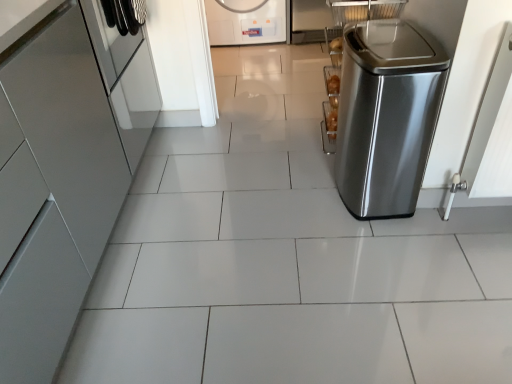
Image resolution: width=512 pixels, height=384 pixels. I want to click on white glossy washing machine at upper center, the second home appliance when ordered from left to right, so click(246, 22).

Is the surface of white glossy washing machine at upper center, the second home appliance when ordered from left to right, in direct contact with glossy metallic cabinet at left, positioned as the first home appliance in left-to-right order?

No, white glossy washing machine at upper center, the second home appliance when ordered from left to right, is not in contact with glossy metallic cabinet at left, positioned as the first home appliance in left-to-right order.

Who is smaller, white glossy washing machine at upper center, positioned as the 1th home appliance in back-to-front order, or glossy metallic cabinet at left, marked as the 3th home appliance in a right-to-left arrangement?

white glossy washing machine at upper center, positioned as the 1th home appliance in back-to-front order, is smaller.

Can you confirm if white glossy washing machine at upper center, positioned as the 1th home appliance in back-to-front order, is wider than glossy metallic cabinet at left, positioned as the first home appliance in left-to-right order?

Yes.

From the image's perspective, between white glossy washing machine at upper center, positioned as the 1th home appliance in back-to-front order, and glossy metallic cabinet at left, which is counted as the 2th home appliance, starting from the back, which one is located above?

white glossy washing machine at upper center, positioned as the 1th home appliance in back-to-front order.

Does point (34, 59) come in front of point (433, 64)?

Yes, point (34, 59) is in front of point (433, 64).

From a real-world perspective, is glossy metallic cabinet at left, the 2th home appliance when ordered from front to back, physically located above or below stainless steel trash can at right, the first home appliance positioned from the front?

Clearly, from a real-world perspective, glossy metallic cabinet at left, the 2th home appliance when ordered from front to back, is above stainless steel trash can at right, the first home appliance positioned from the front.

Which object is thinner, glossy metallic cabinet at left, marked as the 3th home appliance in a right-to-left arrangement, or stainless steel trash can at right, which appears as the first home appliance when viewed from the right?

Thinner between the two is stainless steel trash can at right, which appears as the first home appliance when viewed from the right.

Would you say glossy metallic cabinet at left, positioned as the first home appliance in left-to-right order, is a long distance from stainless steel trash can at right, arranged as the 3th home appliance when viewed from the left?

Yes, glossy metallic cabinet at left, positioned as the first home appliance in left-to-right order, and stainless steel trash can at right, arranged as the 3th home appliance when viewed from the left, are quite far apart.

Which is correct: stainless steel trash can at right, which appears as the first home appliance when viewed from the right, is inside glossy metallic cabinet at left, marked as the 3th home appliance in a right-to-left arrangement, or outside of it?

stainless steel trash can at right, which appears as the first home appliance when viewed from the right, is outside glossy metallic cabinet at left, marked as the 3th home appliance in a right-to-left arrangement.

Which is farther, [383,107] or [95,78]?

Positioned behind is point [383,107].

Is stainless steel trash can at right, arranged as the 3th home appliance when viewed from the left, next to glossy metallic cabinet at left, the 2th home appliance when ordered from front to back, and touching it?

stainless steel trash can at right, arranged as the 3th home appliance when viewed from the left, is not next to glossy metallic cabinet at left, the 2th home appliance when ordered from front to back, and they're not touching.

Is stainless steel trash can at right, which ranks as the third home appliance in back-to-front order, inside or outside of white glossy washing machine at upper center, arranged as the second home appliance when viewed from the right?

stainless steel trash can at right, which ranks as the third home appliance in back-to-front order, lies outside white glossy washing machine at upper center, arranged as the second home appliance when viewed from the right.

Could you tell me if stainless steel trash can at right, arranged as the 3th home appliance when viewed from the left, is turned towards white glossy washing machine at upper center, the second home appliance when ordered from left to right?

No, stainless steel trash can at right, arranged as the 3th home appliance when viewed from the left, does not turn towards white glossy washing machine at upper center, the second home appliance when ordered from left to right.

Which object is thinner, stainless steel trash can at right, which appears as the first home appliance when viewed from the right, or white glossy washing machine at upper center, positioned as the 1th home appliance in back-to-front order?

stainless steel trash can at right, which appears as the first home appliance when viewed from the right, is thinner.

Looking at this image, what's the angular difference between white glossy washing machine at upper center, the 3th home appliance viewed from the front, and stainless steel trash can at right, which appears as the first home appliance when viewed from the right,'s facing directions?

white glossy washing machine at upper center, the 3th home appliance viewed from the front, and stainless steel trash can at right, which appears as the first home appliance when viewed from the right, are facing 88.5 degrees away from each other.

In the scene shown: Which object is positioned more to the left, white glossy washing machine at upper center, positioned as the 1th home appliance in back-to-front order, or stainless steel trash can at right, arranged as the 3th home appliance when viewed from the left?

Positioned to the left is white glossy washing machine at upper center, positioned as the 1th home appliance in back-to-front order.

From a real-world perspective, is white glossy washing machine at upper center, the 3th home appliance viewed from the front, beneath stainless steel trash can at right, which ranks as the third home appliance in back-to-front order?

Yes, from a real-world perspective, white glossy washing machine at upper center, the 3th home appliance viewed from the front, is beneath stainless steel trash can at right, which ranks as the third home appliance in back-to-front order.

From the image's perspective, is white glossy washing machine at upper center, the second home appliance when ordered from left to right, on stainless steel trash can at right, which ranks as the third home appliance in back-to-front order?

Yes, from the image's perspective, white glossy washing machine at upper center, the second home appliance when ordered from left to right, is above stainless steel trash can at right, which ranks as the third home appliance in back-to-front order.

Is glossy metallic cabinet at left, which is counted as the 2th home appliance, starting from the back, facing towards white glossy washing machine at upper center, positioned as the 1th home appliance in back-to-front order?

No, glossy metallic cabinet at left, which is counted as the 2th home appliance, starting from the back, does not turn towards white glossy washing machine at upper center, positioned as the 1th home appliance in back-to-front order.

Between glossy metallic cabinet at left, marked as the 3th home appliance in a right-to-left arrangement, and white glossy washing machine at upper center, the second home appliance when ordered from left to right, which one has more height?

With more height is glossy metallic cabinet at left, marked as the 3th home appliance in a right-to-left arrangement.

Based on the photo, from the image's perspective, is glossy metallic cabinet at left, marked as the 3th home appliance in a right-to-left arrangement, located above or below white glossy washing machine at upper center, positioned as the 1th home appliance in back-to-front order?

glossy metallic cabinet at left, marked as the 3th home appliance in a right-to-left arrangement, is below white glossy washing machine at upper center, positioned as the 1th home appliance in back-to-front order.

At what (x,y) coordinates should I click in order to perform the action: click on home appliance that appears above the glossy metallic cabinet at left, marked as the 3th home appliance in a right-to-left arrangement (from the image's perspective). Please return your answer as a coordinate pair (x, y). Looking at the image, I should click on (246, 22).

At what (x,y) coordinates should I click in order to perform the action: click on the 1st home appliance directly beneath the glossy metallic cabinet at left, the 2th home appliance when ordered from front to back (from a real-world perspective). Please return your answer as a coordinate pair (x, y). The height and width of the screenshot is (384, 512). Looking at the image, I should click on (386, 115).

Based on their spatial positions, is glossy metallic cabinet at left, positioned as the first home appliance in left-to-right order, or white glossy washing machine at upper center, arranged as the second home appliance when viewed from the right, further from stainless steel trash can at right, the first home appliance positioned from the front?

white glossy washing machine at upper center, arranged as the second home appliance when viewed from the right.

Looking at the image, which one is located closer to white glossy washing machine at upper center, arranged as the second home appliance when viewed from the right, stainless steel trash can at right, the first home appliance positioned from the front, or glossy metallic cabinet at left, which is counted as the 2th home appliance, starting from the back?

stainless steel trash can at right, the first home appliance positioned from the front, lies closer to white glossy washing machine at upper center, arranged as the second home appliance when viewed from the right, than the other object.

When comparing their distances from glossy metallic cabinet at left, positioned as the first home appliance in left-to-right order, does white glossy washing machine at upper center, positioned as the 1th home appliance in back-to-front order, or stainless steel trash can at right, which ranks as the third home appliance in back-to-front order, seem further?

white glossy washing machine at upper center, positioned as the 1th home appliance in back-to-front order, is positioned further to the anchor glossy metallic cabinet at left, positioned as the first home appliance in left-to-right order.

Considering their positions, is stainless steel trash can at right, the first home appliance positioned from the front, positioned further to glossy metallic cabinet at left, the 2th home appliance when ordered from front to back, than white glossy washing machine at upper center, the second home appliance when ordered from left to right?

white glossy washing machine at upper center, the second home appliance when ordered from left to right, is further to glossy metallic cabinet at left, the 2th home appliance when ordered from front to back.

When comparing their distances from stainless steel trash can at right, which ranks as the third home appliance in back-to-front order, does white glossy washing machine at upper center, the second home appliance when ordered from left to right, or glossy metallic cabinet at left, the 2th home appliance when ordered from front to back, seem closer?

Based on the image, glossy metallic cabinet at left, the 2th home appliance when ordered from front to back, appears to be nearer to stainless steel trash can at right, which ranks as the third home appliance in back-to-front order.

Estimate the real-world distances between objects in this image. Which object is further from white glossy washing machine at upper center, the second home appliance when ordered from left to right, glossy metallic cabinet at left, the 2th home appliance when ordered from front to back, or stainless steel trash can at right, which ranks as the third home appliance in back-to-front order?

Based on the image, glossy metallic cabinet at left, the 2th home appliance when ordered from front to back, appears to be further to white glossy washing machine at upper center, the second home appliance when ordered from left to right.

Find the location of a particular element. The width and height of the screenshot is (512, 384). home appliance between stainless steel trash can at right, which ranks as the third home appliance in back-to-front order, and white glossy washing machine at upper center, the 3th home appliance viewed from the front, along the z-axis is located at coordinates (63, 169).